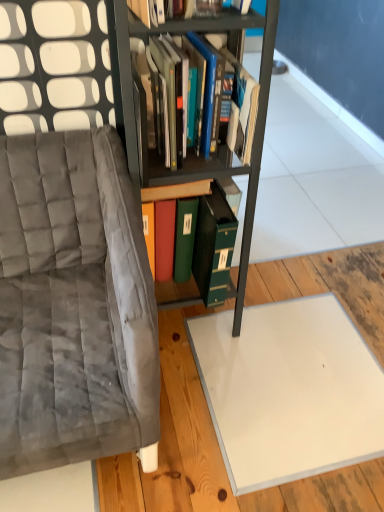
Question: Is green matte file at center, the second book viewed from the top, taller or shorter than metallic black bookcase at center?

Choices:
 (A) tall
 (B) short

Answer: (B)

Question: Would you say green matte file at center, the 1th book in the bottom-to-top sequence, is inside or outside metallic black bookcase at center?

Choices:
 (A) outside
 (B) inside

Answer: (B)

Question: Estimate the real-world distances between objects in this image. Which object is farther from the metallic black bookcase at center?

Choices:
 (A) velvet gray chair at left
 (B) green matte file at center, the 1th book in the bottom-to-top sequence
 (C) hardcover books at center, which ranks as the second book in bottom-to-top order

Answer: (A)

Question: Considering the real-world distances, which object is closest to the velvet gray chair at left?

Choices:
 (A) green matte file at center, the 1th book in the bottom-to-top sequence
 (B) metallic black bookcase at center
 (C) hardcover books at center, the 1th book in the top-to-bottom sequence

Answer: (B)